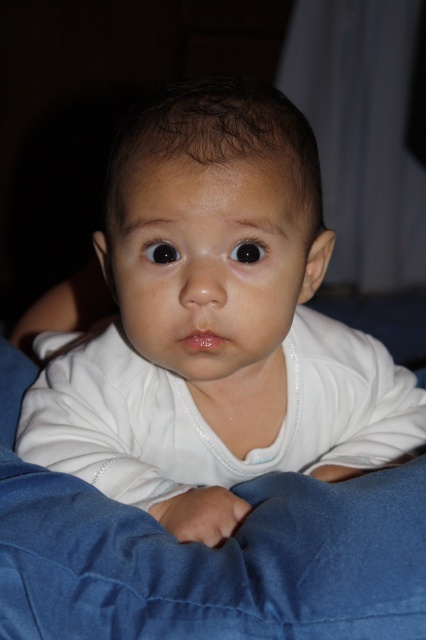
Question: Which point appears farthest from the camera in this image?

Choices:
 (A) (262, 376)
 (B) (57, 586)

Answer: (A)

Question: Is white smooth baby at center to the left of denim at center from the viewer's perspective?

Choices:
 (A) no
 (B) yes

Answer: (A)

Question: Which point appears farthest from the camera in this image?

Choices:
 (A) (176, 541)
 (B) (219, 120)

Answer: (A)

Question: Does white smooth baby at center come in front of denim at center?

Choices:
 (A) yes
 (B) no

Answer: (B)

Question: Which point is closer to the camera taking this photo?

Choices:
 (A) (28, 561)
 (B) (215, 257)

Answer: (A)

Question: Is white smooth baby at center to the right of denim at center from the viewer's perspective?

Choices:
 (A) yes
 (B) no

Answer: (A)